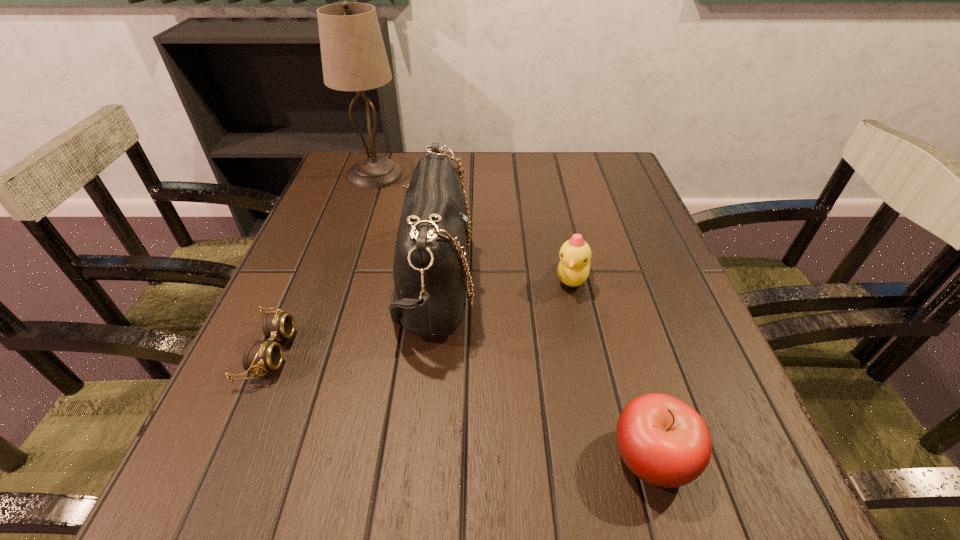
This screenshot has width=960, height=540. Find the location of `free region at the near edge of the desktop`. free region at the near edge of the desktop is located at coordinates (379, 517).

Locate an element on the screen. The height and width of the screenshot is (540, 960). vacant space at the left edge of the desktop is located at coordinates (350, 317).

Where is `vacant space at the right edge of the desktop`? The height and width of the screenshot is (540, 960). vacant space at the right edge of the desktop is located at coordinates (682, 312).

Locate an element on the screen. The image size is (960, 540). vacant space at the far right corner is located at coordinates (585, 179).

The height and width of the screenshot is (540, 960). In order to click on vacant space that's between the apple and the duckling in this screenshot , I will do `click(612, 368)`.

Find the location of a particular element. free space between the shortest object and the lampshade is located at coordinates (323, 263).

Image resolution: width=960 pixels, height=540 pixels. In order to click on vacant area between the duckling and the tallest object in this screenshot , I will do `click(473, 226)`.

You are a GUI agent. You are given a task and a screenshot of the screen. Output one action in this format:
    pyautogui.click(x=<x>, y=<y>)
    Task: Click on the vacant space in between the handbag and the shortest object
    
    Given the screenshot: What is the action you would take?
    pyautogui.click(x=352, y=317)

You are a GUI agent. You are given a task and a screenshot of the screen. Output one action in this format:
    pyautogui.click(x=<x>, y=<y>)
    Task: Click on the free space that is in between the farthest object and the duckling
    This screenshot has height=540, width=960.
    Given the screenshot: What is the action you would take?
    pyautogui.click(x=473, y=226)

In order to click on free area in between the duckling and the nearest object in this screenshot , I will do `click(612, 368)`.